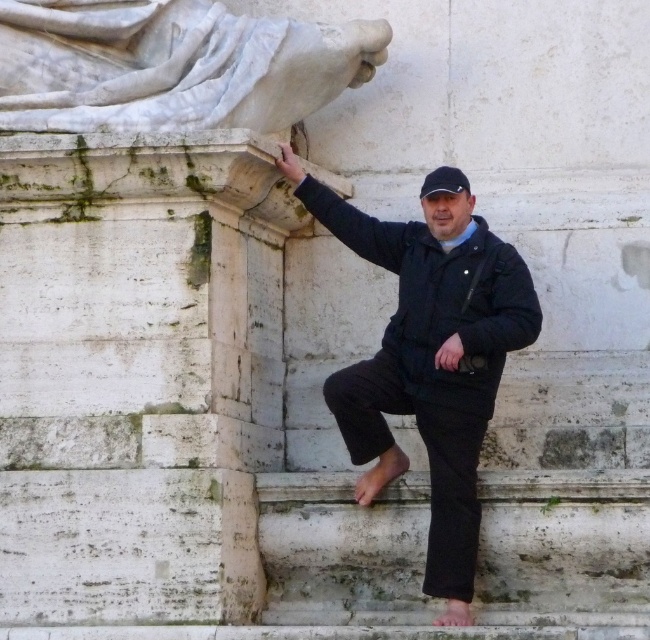
How distant is white marble statue at upper left from black fabric baseball hat at upper center?

A distance of 8.29 meters exists between white marble statue at upper left and black fabric baseball hat at upper center.

Which is behind, point (20, 68) or point (426, 182)?

The point (426, 182) is behind.

Which is in front, point (313, 72) or point (424, 188)?

Point (424, 188)

Locate an element on the screen. The width and height of the screenshot is (650, 640). white marble statue at upper left is located at coordinates (170, 65).

Does black matte jacket at center have a smaller size compared to black fabric baseball hat at upper center?

No.

The image size is (650, 640). What do you see at coordinates (430, 360) in the screenshot?
I see `black matte jacket at center` at bounding box center [430, 360].

Does point (436, 532) come in front of point (462, 180)?

Yes.

Where is `black matte jacket at center`? The image size is (650, 640). black matte jacket at center is located at coordinates (430, 360).

Between black matte jacket at center and white marble statue at upper left, which one is positioned higher?

Positioned higher is white marble statue at upper left.

Can you confirm if black matte jacket at center is positioned above white marble statue at upper left?

No.

Identify the location of black matte jacket at center. (430, 360).

Find the location of a particular element. The width and height of the screenshot is (650, 640). black matte jacket at center is located at coordinates (430, 360).